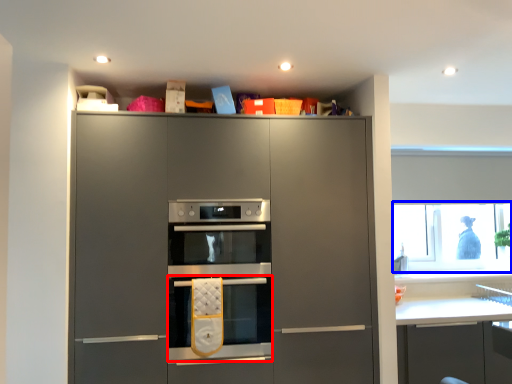
Question: Which object appears farthest to the camera in this image, oven (highlighted by a red box) or window screen (highlighted by a blue box)?

Choices:
 (A) oven
 (B) window screen

Answer: (B)